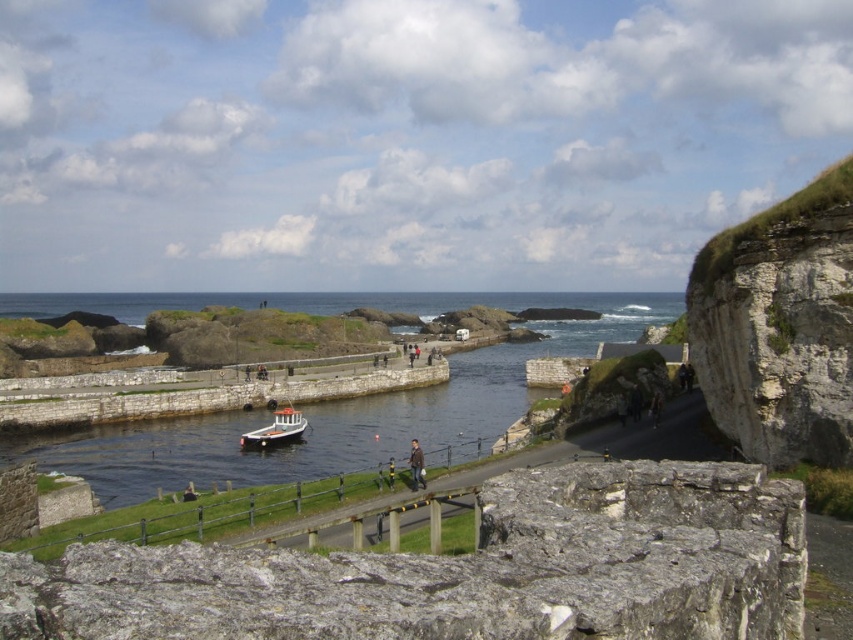
You are a tour guide leading a group of visitors to the white wooden boat at center. You want to inform them how far the gray stone cliff at center is from the boat. What should you tell them?

The gray stone cliff at center is approximately 58.23 meters away from the white wooden boat at center.

In the scene shown: You are standing at the point labeled as point [466,570] in the image. What object is located exactly at that coordinate?

The point [466,570] indicates a gray stone cliff at center.

You are a hiker who wants to take a photo of both the gray stone cliff at center and the gray rocky cliff at right. Which cliff should you stand closer to in order to capture both in a single frame?

You should stand closer to the gray stone cliff at center because it is smaller than the gray rocky cliff at right, allowing both to fit within the camera frame when positioned nearer to the smaller one.